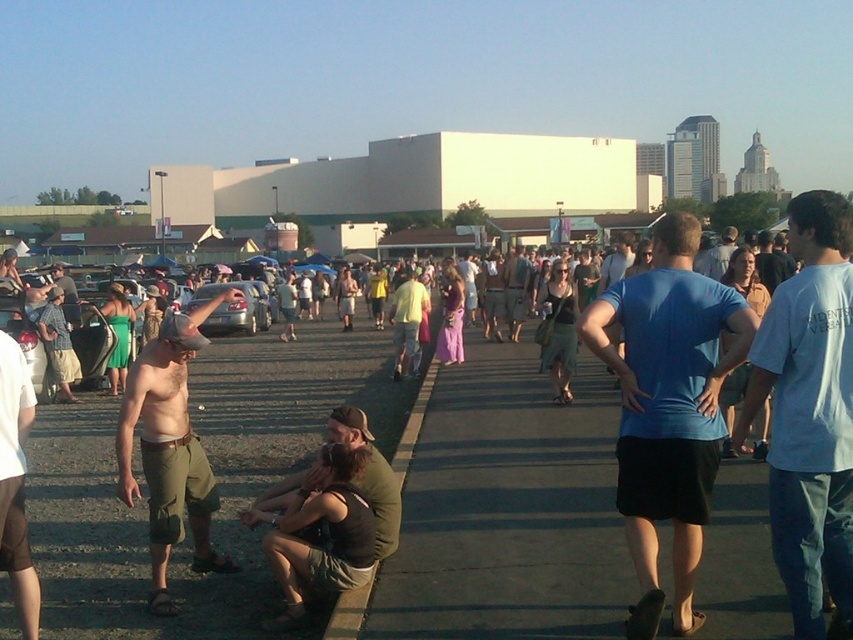
You are standing at the point with coordinates point (350, 417) and want to walk towards the point with coordinates point (692, 292). Which direction should you face to walk directly towards it?

You should face forward because point (692, 292) is in front of point (350, 417).

You are a photographer trying to capture a clear shot of both the green cotton shorts at lower left and the green canvas jacket at lower center. Since they are both green, you want to ensure the viewer can distinguish between them. Based on their positions, which object is closer to the camera?

The green cotton shorts at lower left is in front of the green canvas jacket at lower center, so it is closer to the camera and would appear more prominent in the photo.